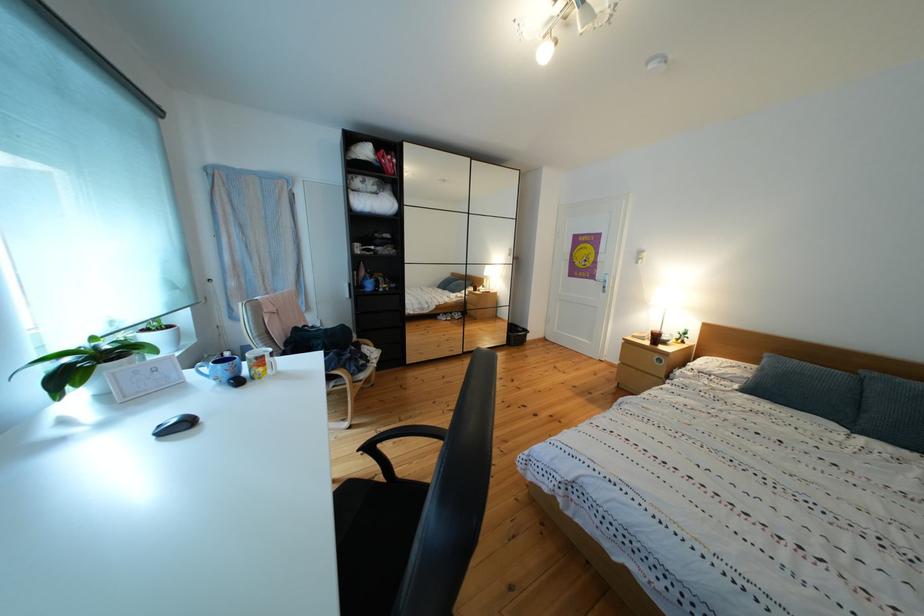
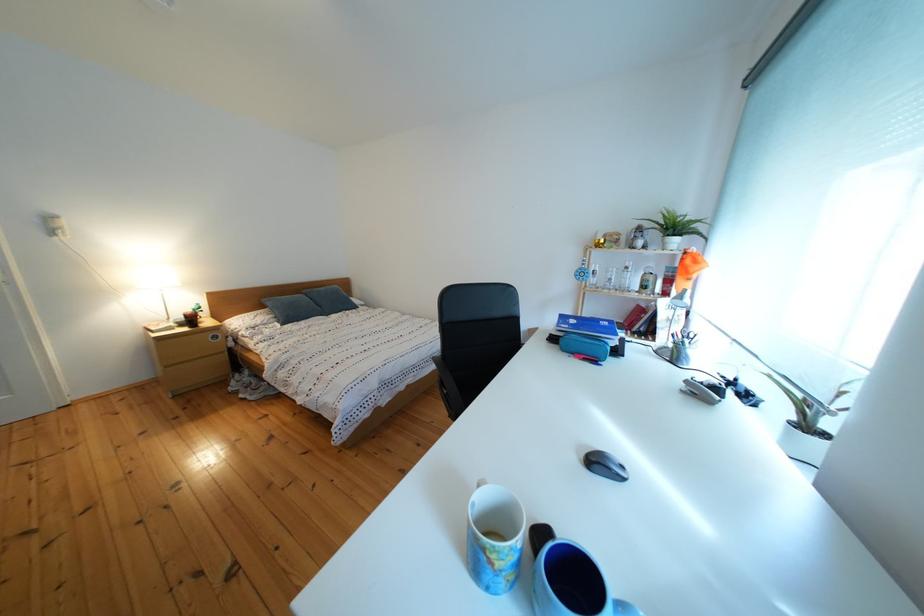
Question: I am providing you with two images of the same scene from different viewpoints. Please identify which objects are invisible in image2.

Choices:
 (A) black vacuum hose
 (B) clear glass bottle
 (C) blue pencil case
 (D) black chair armrest

Answer: (D)